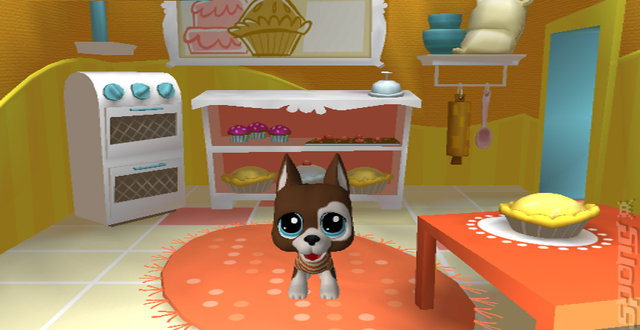
At what (x,y) coordinates should I click in order to perform the action: click on third knob on oven from the left. Please return your answer as a coordinate pair (x, y). This screenshot has width=640, height=330. Looking at the image, I should click on (164, 86).